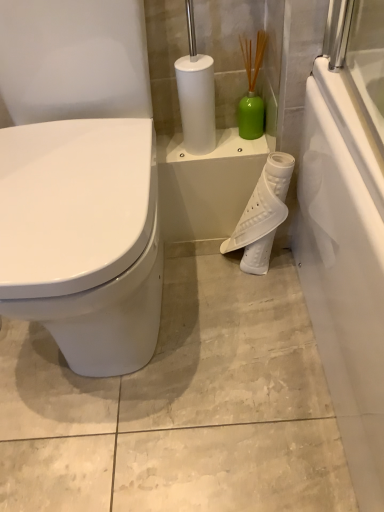
Question: Is white glossy toilet at left taller or shorter than white plastic toilet paper at center?

Choices:
 (A) short
 (B) tall

Answer: (B)

Question: Is point (137, 261) closer or farther from the camera than point (269, 217)?

Choices:
 (A) farther
 (B) closer

Answer: (B)

Question: In terms of width, does white glossy toilet at left look wider or thinner when compared to white plastic toilet paper at center?

Choices:
 (A) thin
 (B) wide

Answer: (B)

Question: In terms of size, does white plastic toilet paper at center appear bigger or smaller than white glossy toilet at left?

Choices:
 (A) small
 (B) big

Answer: (A)

Question: Considering the positions of white plastic toilet paper at center and white glossy toilet at left in the image, is white plastic toilet paper at center taller or shorter than white glossy toilet at left?

Choices:
 (A) tall
 (B) short

Answer: (B)

Question: From a real-world perspective, is white plastic toilet paper at center physically located above or below white glossy toilet at left?

Choices:
 (A) below
 (B) above

Answer: (A)

Question: Is white plastic toilet paper at center wider or thinner than white glossy toilet at left?

Choices:
 (A) thin
 (B) wide

Answer: (A)